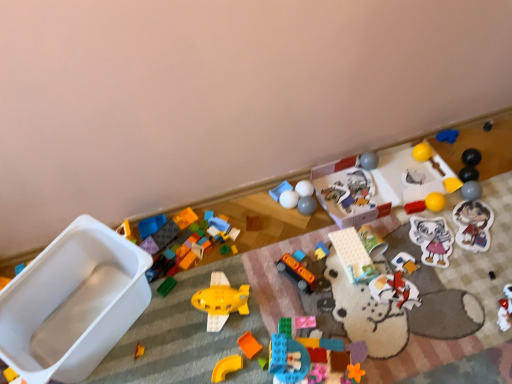
Locate an element on the screen. The width and height of the screenshot is (512, 384). free space in front of matte gray ball at center, which is counted as the twelfth toy, starting from the right is located at coordinates (316, 245).